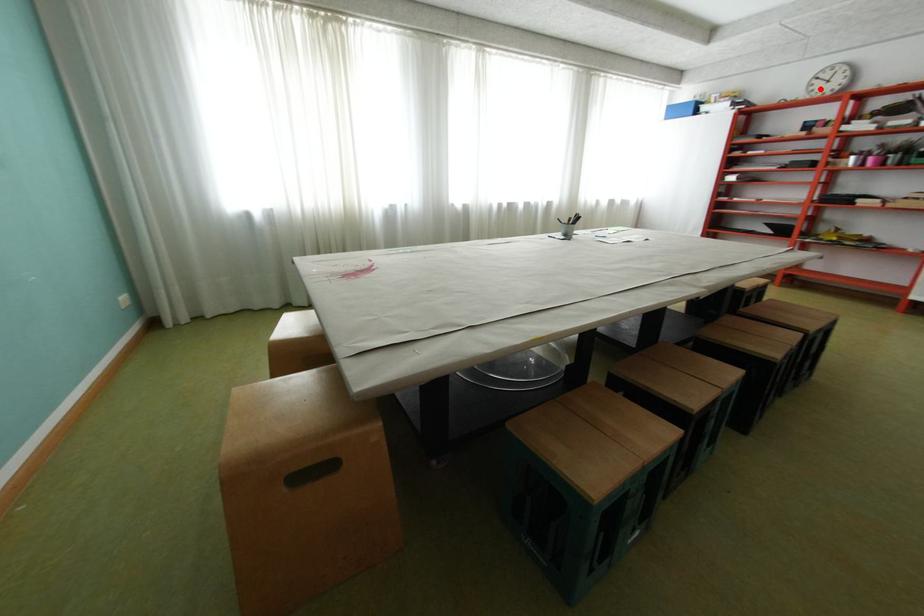
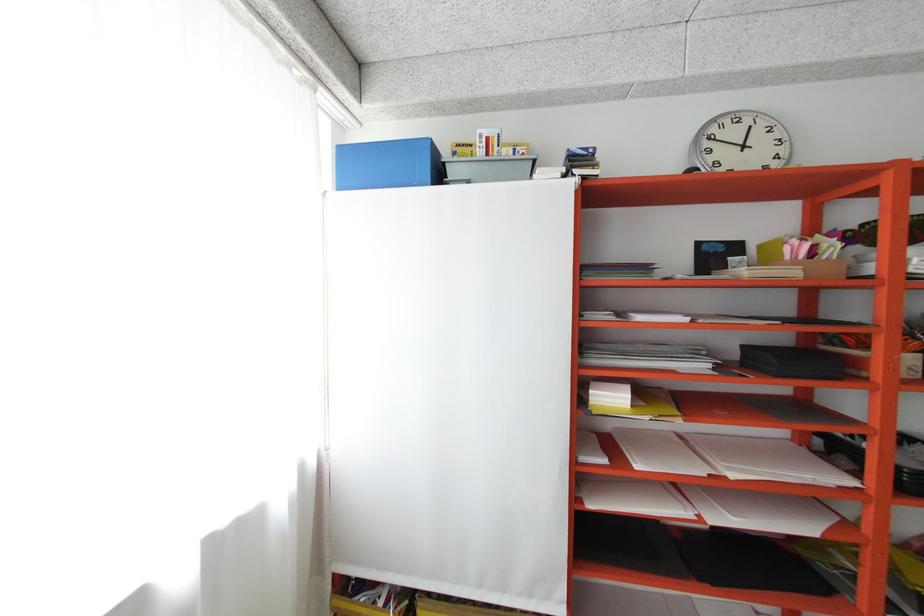
Where in the second image is the point corresponding to the highlighted location from the first image?

(720, 159)